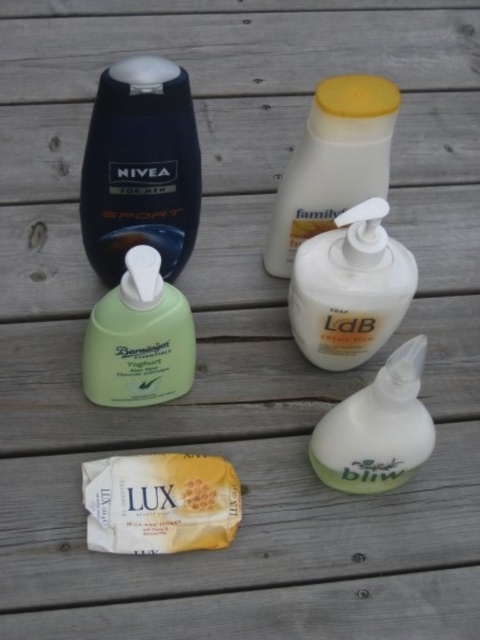
Question: Which point is closer to the camera?

Choices:
 (A) translucent plastic pump bottle at center
 (B) yellow matte soap bar at lower center

Answer: (A)

Question: Considering the real-world distances, which object is closest to the yellow matte soap bar at lower center?

Choices:
 (A) green matte hand soap at center
 (B) translucent plastic pump bottle at center
 (C) matte black bottle at upper left
 (D) white matte lotion at upper center

Answer: (A)

Question: Which is nearer to the yellow matte soap bar at lower center?

Choices:
 (A) white matte squeeze bottle at lower right
 (B) green matte hand soap at center
 (C) white matte lotion at upper center

Answer: (B)

Question: Can you confirm if white matte lotion at upper center is positioned to the right of yellow matte soap bar at lower center?

Choices:
 (A) yes
 (B) no

Answer: (A)

Question: Does matte black bottle at upper left appear on the right side of green matte hand soap at center?

Choices:
 (A) yes
 (B) no

Answer: (B)

Question: Observing the image, what is the correct spatial positioning of matte black bottle at upper left in reference to translucent plastic pump bottle at center?

Choices:
 (A) right
 (B) left

Answer: (B)